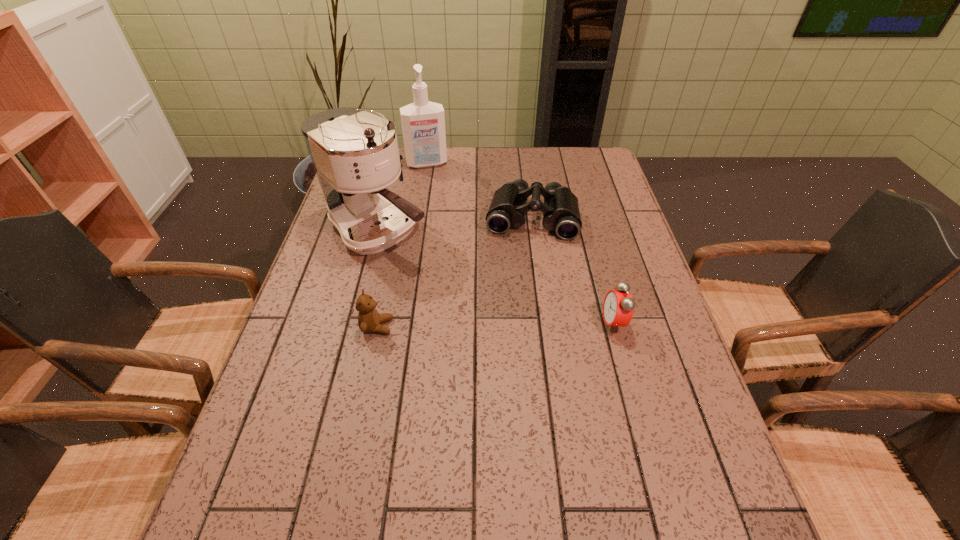
The image size is (960, 540). I want to click on vacant position in the image that satisfies the following two spatial constraints: 1. on the front side of the binoculars; 2. on the front-facing side of the alarm clock, so click(545, 323).